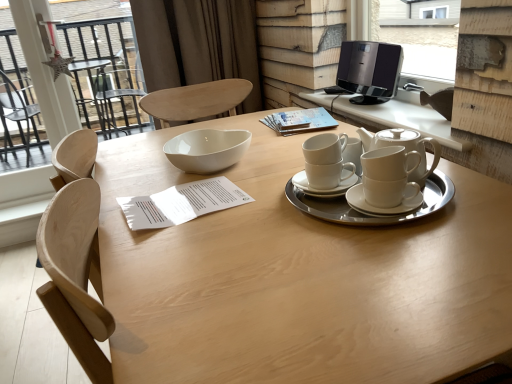
Locate an element on the screen. free space in front of white ceramic teapot at upper right is located at coordinates (430, 229).